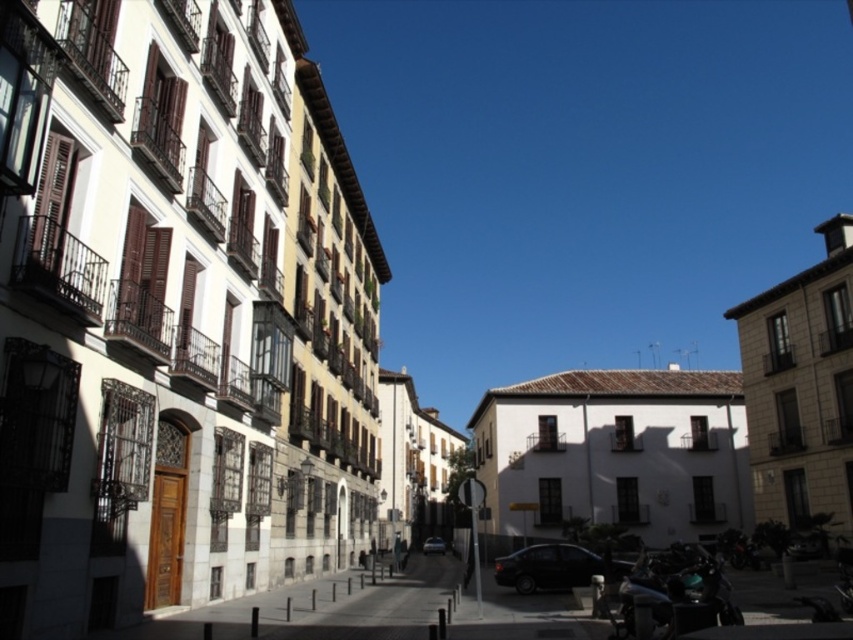
Question: Which point is closer to the camera?

Choices:
 (A) shiny black motorcycle at lower right
 (B) shiny black car at center
 (C) shiny silver car at center

Answer: (A)

Question: Which point is closer to the camera taking this photo?

Choices:
 (A) (579, 552)
 (B) (358, 609)
 (C) (427, 552)

Answer: (B)

Question: Does shiny black car at center appear on the right side of shiny silver car at center?

Choices:
 (A) yes
 (B) no

Answer: (A)

Question: In this image, where is shiny black car at center located relative to shiny black sedan at center?

Choices:
 (A) below
 (B) above

Answer: (B)

Question: Which object is farther from the camera taking this photo?

Choices:
 (A) shiny black motorcycle at lower right
 (B) shiny silver car at center
 (C) shiny black sedan at center

Answer: (B)

Question: Does shiny black car at center have a smaller size compared to shiny black sedan at center?

Choices:
 (A) yes
 (B) no

Answer: (B)